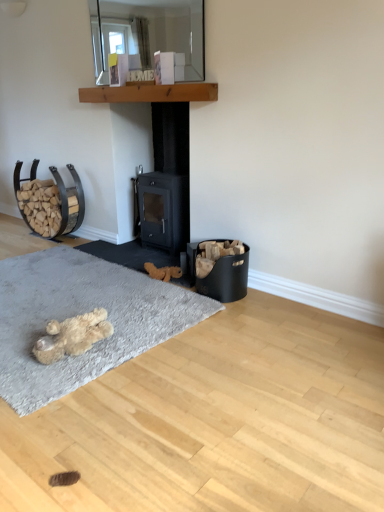
Find the location of `vacant space to the left of fuzzy beige teddy bear at lower left, which appears as the second animal when viewed from the back`. vacant space to the left of fuzzy beige teddy bear at lower left, which appears as the second animal when viewed from the back is located at coordinates (19, 338).